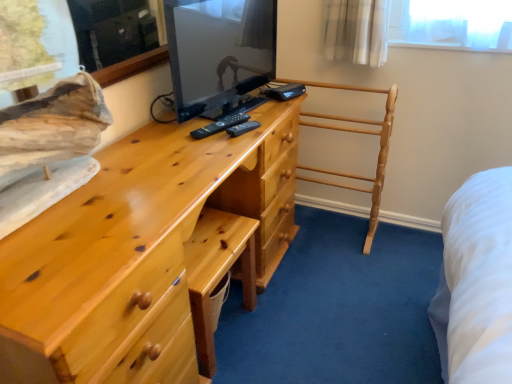
The height and width of the screenshot is (384, 512). What are the coordinates of `vacant area that lies between matte black tv at center and black plastic remote at center` in the screenshot? It's located at (248, 106).